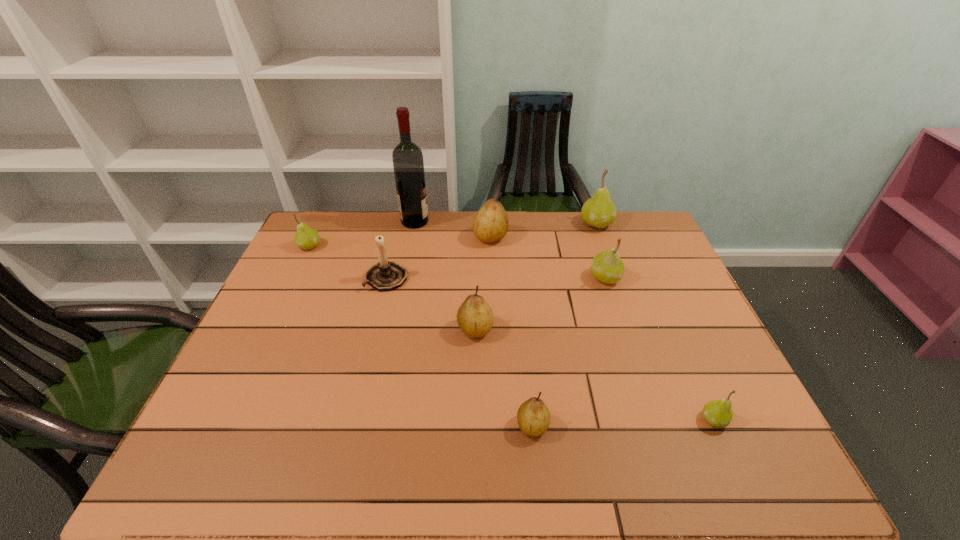
At what (x,y) coordinates should I click in order to perform the action: click on the tallest object. Please return your answer as a coordinate pair (x, y). The width and height of the screenshot is (960, 540). Looking at the image, I should click on (408, 164).

Identify the location of alcohol. (408, 164).

At what (x,y) coordinates should I click in order to perform the action: click on the farthest green pear. Please return your answer as a coordinate pair (x, y). This screenshot has height=540, width=960. Looking at the image, I should click on (599, 211).

You are a GUI agent. You are given a task and a screenshot of the screen. Output one action in this format:
    pyautogui.click(x=<x>, y=<y>)
    Task: Click on the tallest pear
    This screenshot has width=960, height=540.
    Given the screenshot: What is the action you would take?
    pyautogui.click(x=599, y=211)

Where is `the farthest brown pear`? This screenshot has width=960, height=540. the farthest brown pear is located at coordinates (490, 224).

The width and height of the screenshot is (960, 540). I want to click on the second nearest green pear, so tap(607, 267).

Find the location of a particular element. The image size is (960, 540). the third smallest green pear is located at coordinates (607, 267).

At what (x,y) coordinates should I click in order to perform the action: click on candle holder. Please return your answer as a coordinate pair (x, y). The height and width of the screenshot is (540, 960). Looking at the image, I should click on (385, 275).

Find the location of a particular element. the seventh farthest object is located at coordinates (475, 317).

You are a GUI agent. You are given a task and a screenshot of the screen. Output one action in this format:
    pyautogui.click(x=<x>, y=<y>)
    Task: Click on the second biggest brown pear
    This screenshot has width=960, height=540.
    Given the screenshot: What is the action you would take?
    pyautogui.click(x=475, y=317)